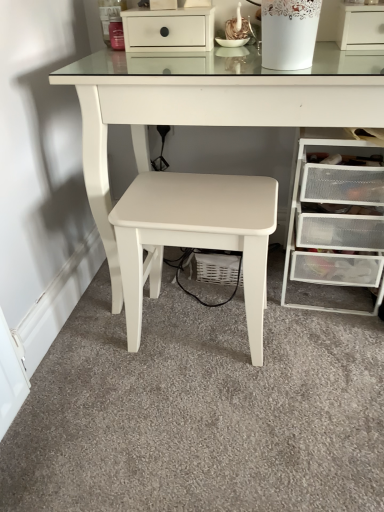
I want to click on white matte drawer at upper center, which appears as the second chest of drawers when ordered from the bottom, so click(169, 30).

What is the approximate width of clear plastic drawers at lower right, which appears as the 1th chest of drawers when viewed from the right?

The width of clear plastic drawers at lower right, which appears as the 1th chest of drawers when viewed from the right, is 16.34 inches.

Find the location of a particular element. white matte stool at center is located at coordinates (195, 236).

Where is `white matte drawer at upper center, positioned as the first chest of drawers in top-to-bottom order`? This screenshot has height=512, width=384. white matte drawer at upper center, positioned as the first chest of drawers in top-to-bottom order is located at coordinates (169, 30).

From a real-world perspective, which object rests below the other?

From a 3D spatial view, clear plastic drawers at lower right, which appears as the second chest of drawers when viewed from the top, is below.

Where is `chest of drawers above the clear plastic drawers at lower right, arranged as the first chest of drawers when ordered from the bottom (from a real-world perspective)`? chest of drawers above the clear plastic drawers at lower right, arranged as the first chest of drawers when ordered from the bottom (from a real-world perspective) is located at coordinates (169, 30).

Is clear plastic drawers at lower right, acting as the second chest of drawers starting from the left, inside the boundaries of white matte drawer at upper center, positioned as the first chest of drawers in top-to-bottom order, or outside?

clear plastic drawers at lower right, acting as the second chest of drawers starting from the left, cannot be found inside white matte drawer at upper center, positioned as the first chest of drawers in top-to-bottom order.

Which of these two, clear plastic drawers at lower right, arranged as the first chest of drawers when ordered from the bottom, or white matte drawer at upper center, which ranks as the first chest of drawers in left-to-right order, is bigger?

Bigger between the two is clear plastic drawers at lower right, arranged as the first chest of drawers when ordered from the bottom.

Is white glossy table at center bigger or smaller than white matte stool at center?

In the image, white glossy table at center appears to be larger than white matte stool at center.

Find the location of a particular element. Image resolution: width=384 pixels, height=512 pixels. stool behind the white glossy table at center is located at coordinates (195, 236).

Is white glossy table at center facing away from white matte stool at center?

Yes.

From the picture: In the image, is white glossy table at center on the left side or the right side of white matte stool at center?

From the image, it's evident that white glossy table at center is to the right of white matte stool at center.

Can white matte drawer at upper center, which ranks as the first chest of drawers in left-to-right order, be found inside white matte stool at center?

No.

Image resolution: width=384 pixels, height=512 pixels. Identify the location of stool located in front of the white matte drawer at upper center, which ranks as the 2th chest of drawers in right-to-left order. (195, 236).

From the image's perspective, who appears lower, white matte stool at center or white matte drawer at upper center, which ranks as the first chest of drawers in left-to-right order?

white matte stool at center, from the image's perspective.

Consider the image. Does white porcelain vase at upper center have a smaller size compared to white matte drawer at upper center, which ranks as the first chest of drawers in left-to-right order?

Indeed, white porcelain vase at upper center has a smaller size compared to white matte drawer at upper center, which ranks as the first chest of drawers in left-to-right order.

From the image's perspective, is white porcelain vase at upper center located above or below white matte drawer at upper center, which ranks as the 2th chest of drawers in right-to-left order?

Based on their image positions, white porcelain vase at upper center is located beneath white matte drawer at upper center, which ranks as the 2th chest of drawers in right-to-left order.

Does white porcelain vase at upper center have a lesser width compared to white matte drawer at upper center, which ranks as the first chest of drawers in left-to-right order?

Correct, the width of white porcelain vase at upper center is less than that of white matte drawer at upper center, which ranks as the first chest of drawers in left-to-right order.

Could white glossy table at center be considered to be inside clear plastic drawers at lower right, which appears as the second chest of drawers when viewed from the top?

No.

Considering the positions of objects clear plastic drawers at lower right, acting as the second chest of drawers starting from the left, and white glossy table at center in the image provided, who is more to the left, clear plastic drawers at lower right, acting as the second chest of drawers starting from the left, or white glossy table at center?

From the viewer's perspective, white glossy table at center appears more on the left side.

From the image's perspective, would you say clear plastic drawers at lower right, acting as the second chest of drawers starting from the left, is shown under white glossy table at center?

Yes, from the image's perspective, clear plastic drawers at lower right, acting as the second chest of drawers starting from the left, is below white glossy table at center.

Based on the photo, is clear plastic drawers at lower right, which appears as the 1th chest of drawers when viewed from the right, looking in the opposite direction of white glossy table at center?

Yes, white glossy table at center is at the back of clear plastic drawers at lower right, which appears as the 1th chest of drawers when viewed from the right.

Which is nearer, (225, 211) or (277, 61)?

The point (277, 61) is closer.

From the picture: Is white matte stool at center beside white porcelain vase at upper center?

No, white matte stool at center is not with white porcelain vase at upper center.

Considering the relative positions of white matte stool at center and white porcelain vase at upper center in the image provided, is white matte stool at center behind white porcelain vase at upper center?

Yes, it is behind white porcelain vase at upper center.

Based on the photo, can we say white matte stool at center lies outside white porcelain vase at upper center?

Yes, white matte stool at center is located beyond the bounds of white porcelain vase at upper center.

Is white porcelain vase at upper center shorter than white matte stool at center?

Correct, white porcelain vase at upper center is not as tall as white matte stool at center.

From a real-world perspective, is white porcelain vase at upper center physically located above or below white matte stool at center?

white porcelain vase at upper center is situated higher than white matte stool at center in the real world.

Between white porcelain vase at upper center and white matte stool at center, which one has larger width?

white matte stool at center.

You are a GUI agent. You are given a task and a screenshot of the screen. Output one action in this format:
    pyautogui.click(x=<x>, y=<y>)
    Task: Click on the chest of drawers on the left of clear plastic drawers at lower right, arranged as the first chest of drawers when ordered from the bottom
    The height and width of the screenshot is (512, 384).
    Given the screenshot: What is the action you would take?
    pyautogui.click(x=169, y=30)

In the image, there is a white matte stool at center. Where is `table above it (from the image's perspective)`? table above it (from the image's perspective) is located at coordinates (209, 105).

Based on their spatial positions, is white glossy table at center or clear plastic drawers at lower right, arranged as the first chest of drawers when ordered from the bottom, closer to white matte stool at center?

Among the two, white glossy table at center is located nearer to white matte stool at center.

Estimate the real-world distances between objects in this image. Which object is closer to white porcelain vase at upper center, clear plastic drawers at lower right, which appears as the 1th chest of drawers when viewed from the right, or white matte stool at center?

Based on the image, white matte stool at center appears to be nearer to white porcelain vase at upper center.

In the scene shown: Looking at the image, which one is located closer to white matte drawer at upper center, which appears as the second chest of drawers when ordered from the bottom, white porcelain vase at upper center or white glossy table at center?

white glossy table at center.

Which object lies further to the anchor point white matte drawer at upper center, which ranks as the 2th chest of drawers in right-to-left order, white glossy table at center or clear plastic drawers at lower right, acting as the second chest of drawers starting from the left?

clear plastic drawers at lower right, acting as the second chest of drawers starting from the left, is positioned further to the anchor white matte drawer at upper center, which ranks as the 2th chest of drawers in right-to-left order.

When comparing their distances from white glossy table at center, does clear plastic drawers at lower right, which appears as the 1th chest of drawers when viewed from the right, or white porcelain vase at upper center seem closer?

white porcelain vase at upper center is closer to white glossy table at center.

Looking at the image, which one is located further to white matte stool at center, clear plastic drawers at lower right, which appears as the 1th chest of drawers when viewed from the right, or white porcelain vase at upper center?

Among the two, white porcelain vase at upper center is located further to white matte stool at center.

From the image, which object appears to be nearer to white glossy table at center, white porcelain vase at upper center or white matte drawer at upper center, which appears as the second chest of drawers when ordered from the bottom?

The object closer to white glossy table at center is white matte drawer at upper center, which appears as the second chest of drawers when ordered from the bottom.

Based on the photo, which object lies further to the anchor point white matte stool at center, white glossy table at center or white porcelain vase at upper center?

white porcelain vase at upper center.

You are a GUI agent. You are given a task and a screenshot of the screen. Output one action in this format:
    pyautogui.click(x=<x>, y=<y>)
    Task: Click on the glass vase between white matte drawer at upper center, which ranks as the 2th chest of drawers in right-to-left order, and clear plastic drawers at lower right, acting as the second chest of drawers starting from the left, in the horizontal direction
    The image size is (384, 512).
    Given the screenshot: What is the action you would take?
    pyautogui.click(x=289, y=33)

In order to click on the chest of drawers that lies between white matte drawer at upper center, which appears as the second chest of drawers when ordered from the bottom, and white matte stool at center from top to bottom in this screenshot , I will do `click(335, 219)`.

Where is `glass vase that lies between white matte drawer at upper center, which ranks as the first chest of drawers in left-to-right order, and white matte stool at center from top to bottom`? glass vase that lies between white matte drawer at upper center, which ranks as the first chest of drawers in left-to-right order, and white matte stool at center from top to bottom is located at coordinates (289, 33).

Identify the location of table between white matte drawer at upper center, which appears as the second chest of drawers when ordered from the bottom, and clear plastic drawers at lower right, arranged as the first chest of drawers when ordered from the bottom, in the vertical direction. (209, 105).